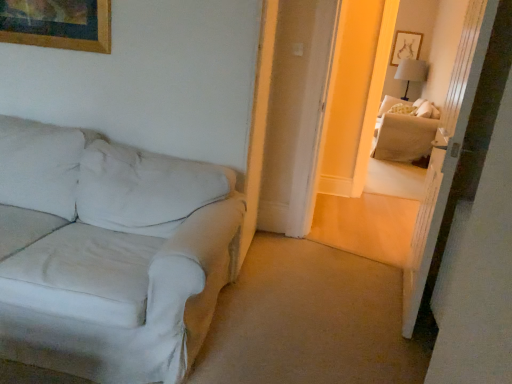
The height and width of the screenshot is (384, 512). I want to click on white fabric couch at left, so [x=109, y=253].

The width and height of the screenshot is (512, 384). What do you see at coordinates (411, 73) in the screenshot?
I see `gray fabric table lamp at upper right` at bounding box center [411, 73].

The height and width of the screenshot is (384, 512). What do you see at coordinates (403, 132) in the screenshot?
I see `beige fabric couch at right` at bounding box center [403, 132].

This screenshot has height=384, width=512. What are the coordinates of `beige fabric couch at right` in the screenshot? It's located at (403, 132).

Measure the distance between point (452, 150) and camera.

Point (452, 150) and camera are 1.98 meters apart from each other.

Where is `transparent glass door at upper right`? transparent glass door at upper right is located at coordinates (446, 155).

This screenshot has width=512, height=384. What are the coordinates of `white fabric couch at left` in the screenshot? It's located at (x=109, y=253).

Considering the positions of points (414, 104) and (174, 369), is point (414, 104) farther from camera compared to point (174, 369)?

Yes.

Is beige fabric couch at right looking in the opposite direction of white fabric couch at left?

beige fabric couch at right does not have its back to white fabric couch at left.

Considering the sizes of objects beige fabric couch at right and white fabric couch at left in the image provided, who is smaller, beige fabric couch at right or white fabric couch at left?

white fabric couch at left is smaller.

Is beige fabric couch at right not inside white fabric couch at left?

That's correct, beige fabric couch at right is outside of white fabric couch at left.

In terms of size, does white fabric couch at left appear bigger or smaller than transparent glass door at upper right?

Clearly, white fabric couch at left is larger in size than transparent glass door at upper right.

Is white fabric couch at left to the left of transparent glass door at upper right from the viewer's perspective?

Yes, white fabric couch at left is to the left of transparent glass door at upper right.

Is transparent glass door at upper right completely or partially inside white fabric couch at left?

No, transparent glass door at upper right is not a part of white fabric couch at left.

From a real-world perspective, which object stands above the other?

From a 3D spatial view, transparent glass door at upper right is above.

Considering the positions of objects white fabric couch at left and gray fabric table lamp at upper right in the image provided, who is in front, white fabric couch at left or gray fabric table lamp at upper right?

Positioned in front is white fabric couch at left.

Is white fabric couch at left oriented towards gray fabric table lamp at upper right?

No.

Looking at this image, is white fabric couch at left spatially inside gray fabric table lamp at upper right, or outside of it?

The correct answer is: outside.

From the image's perspective, which one is positioned higher, white fabric couch at left or gray fabric table lamp at upper right?

gray fabric table lamp at upper right.

Does beige fabric couch at right appear on the left side of transparent glass door at upper right?

No.

From the image's perspective, which object appears higher, beige fabric couch at right or transparent glass door at upper right?

beige fabric couch at right appears higher in the image.

Does beige fabric couch at right turn towards transparent glass door at upper right?

No, beige fabric couch at right is not oriented towards transparent glass door at upper right.

Which object is closer to the camera, beige fabric couch at right or transparent glass door at upper right?

transparent glass door at upper right.

Based on the photo, from the image's perspective, which is below, transparent glass door at upper right or gray fabric table lamp at upper right?

transparent glass door at upper right is shown below in the image.

I want to click on table lamp located behind the transparent glass door at upper right, so click(x=411, y=73).

From a real-world perspective, who is located lower, transparent glass door at upper right or gray fabric table lamp at upper right?

transparent glass door at upper right, from a real-world perspective.

Which object is closer to the camera, transparent glass door at upper right or gray fabric table lamp at upper right?

transparent glass door at upper right is in front.

You are a GUI agent. You are given a task and a screenshot of the screen. Output one action in this format:
    pyautogui.click(x=<x>, y=<y>)
    Task: Click on the studio couch on the left of the gray fabric table lamp at upper right
    
    Given the screenshot: What is the action you would take?
    pyautogui.click(x=109, y=253)

How far apart are gray fabric table lamp at upper right and white fabric couch at left?

20.86 feet.

Considering the sizes of objects gray fabric table lamp at upper right and white fabric couch at left in the image provided, who is shorter, gray fabric table lamp at upper right or white fabric couch at left?

Standing shorter between the two is gray fabric table lamp at upper right.

Who is bigger, gray fabric table lamp at upper right or white fabric couch at left?

With larger size is white fabric couch at left.

Is transparent glass door at upper right in contact with white fabric couch at left?

No, transparent glass door at upper right is not in contact with white fabric couch at left.

Is transparent glass door at upper right located outside white fabric couch at left?

Yes, transparent glass door at upper right is outside of white fabric couch at left.

In the image, there is a white fabric couch at left. Identify the location of glass door above it (from the image's perspective). This screenshot has height=384, width=512. (446, 155).

Can you confirm if transparent glass door at upper right is smaller than white fabric couch at left?

Yes, transparent glass door at upper right is smaller than white fabric couch at left.

You are a GUI agent. You are given a task and a screenshot of the screen. Output one action in this format:
    pyautogui.click(x=<x>, y=<y>)
    Task: Click on the studio couch that appears in front of the beige fabric couch at right
    The image size is (512, 384).
    Given the screenshot: What is the action you would take?
    pyautogui.click(x=109, y=253)

This screenshot has width=512, height=384. Identify the location of glass door that is above the white fabric couch at left (from a real-world perspective). (446, 155).

Which object lies nearer to the anchor point transparent glass door at upper right, beige fabric couch at right or white fabric couch at left?

Based on the image, white fabric couch at left appears to be nearer to transparent glass door at upper right.

Consider the image. When comparing their distances from white fabric couch at left, does transparent glass door at upper right or gray fabric table lamp at upper right seem further?

gray fabric table lamp at upper right lies further to white fabric couch at left than the other object.

Which object lies further to the anchor point gray fabric table lamp at upper right, beige fabric couch at right or white fabric couch at left?

Based on the image, white fabric couch at left appears to be further to gray fabric table lamp at upper right.

From the image, which object appears to be nearer to transparent glass door at upper right, beige fabric couch at right or gray fabric table lamp at upper right?

The object closer to transparent glass door at upper right is beige fabric couch at right.

Considering their positions, is white fabric couch at left positioned closer to gray fabric table lamp at upper right than transparent glass door at upper right?

Based on the image, transparent glass door at upper right appears to be nearer to gray fabric table lamp at upper right.

Looking at this image, looking at the image, which one is located further to gray fabric table lamp at upper right, transparent glass door at upper right or white fabric couch at left?

Based on the image, white fabric couch at left appears to be further to gray fabric table lamp at upper right.

Estimate the real-world distances between objects in this image. Which object is further from gray fabric table lamp at upper right, beige fabric couch at right or transparent glass door at upper right?

transparent glass door at upper right.

Considering their positions, is gray fabric table lamp at upper right positioned closer to transparent glass door at upper right than white fabric couch at left?

white fabric couch at left.

Locate an element on the screen. The width and height of the screenshot is (512, 384). glass door between white fabric couch at left and gray fabric table lamp at upper right along the z-axis is located at coordinates (446, 155).

Locate an element on the screen. The image size is (512, 384). couch between white fabric couch at left and gray fabric table lamp at upper right in the front-back direction is located at coordinates (403, 132).

Where is `couch between transparent glass door at upper right and gray fabric table lamp at upper right from front to back`? couch between transparent glass door at upper right and gray fabric table lamp at upper right from front to back is located at coordinates (403, 132).

Where is `glass door between white fabric couch at left and beige fabric couch at right along the z-axis`? The height and width of the screenshot is (384, 512). glass door between white fabric couch at left and beige fabric couch at right along the z-axis is located at coordinates (x=446, y=155).